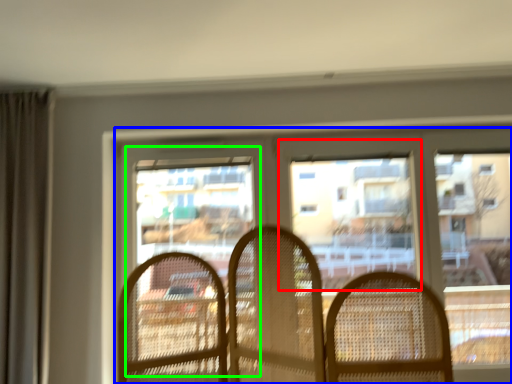
Question: Considering the real-world distances, which object is farthest from window screen (highlighted by a red box)? window (highlighted by a blue box) or screen door (highlighted by a green box)?

Choices:
 (A) window
 (B) screen door

Answer: (B)